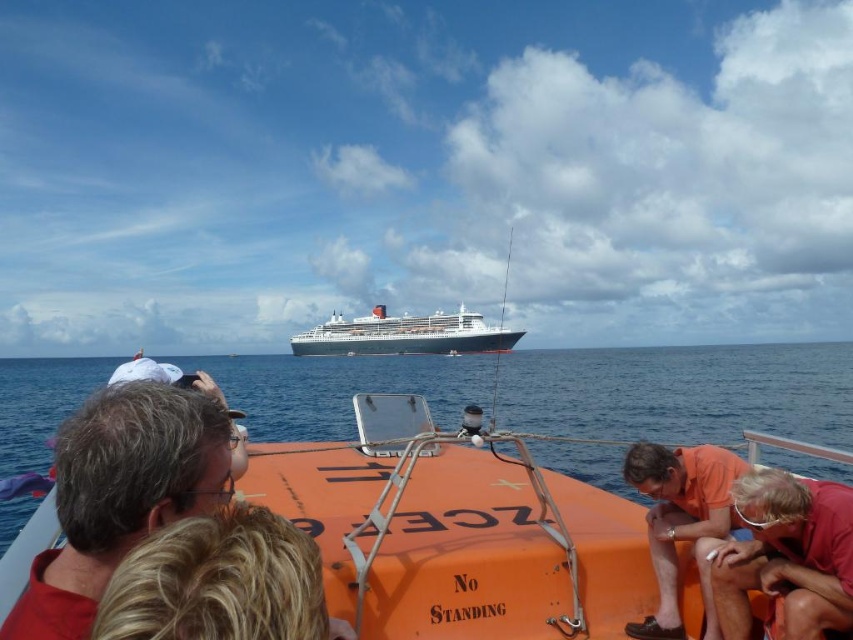
Which is in front, point (709, 515) or point (372, 349)?

Positioned in front is point (709, 515).

Does orange matte shirt at lower right come behind white glossy cruise ship at center?

No.

Identify the location of orange matte shirt at lower right. The height and width of the screenshot is (640, 853). (682, 522).

Is point (730, 397) positioned behind point (730, 556)?

Yes, point (730, 397) is farther from viewer.

Does point (596, 461) come in front of point (757, 518)?

No.

At what (x,y) coordinates should I click in order to perform the action: click on blue water at center. Please return your answer as a coordinate pair (x, y). Image resolution: width=853 pixels, height=640 pixels. Looking at the image, I should click on (682, 392).

Does blue water at center lie in front of white glossy cruise ship at center?

Yes.

This screenshot has width=853, height=640. What do you see at coordinates (682, 392) in the screenshot? I see `blue water at center` at bounding box center [682, 392].

Find the location of a particular element. The height and width of the screenshot is (640, 853). blue water at center is located at coordinates (682, 392).